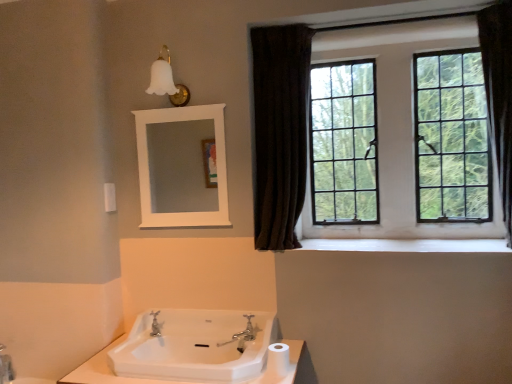
What do you see at coordinates (279, 131) in the screenshot? This screenshot has width=512, height=384. I see `dark brown velvet curtain at upper right` at bounding box center [279, 131].

The height and width of the screenshot is (384, 512). Describe the element at coordinates (167, 80) in the screenshot. I see `white glass sconce at upper left` at that location.

What do you see at coordinates (109, 197) in the screenshot? I see `white plastic towel bar at upper left` at bounding box center [109, 197].

You are a GUI agent. You are given a task and a screenshot of the screen. Output one action in this format:
    pyautogui.click(x=<x>, y=<y>)
    Task: Click on the silver metallic tap at lower center
    Image resolution: width=512 pixels, height=384 pixels.
    Given the screenshot: What is the action you would take?
    pyautogui.click(x=155, y=325)

What do you see at coordinates (155, 325) in the screenshot? The width and height of the screenshot is (512, 384). I see `silver metallic tap at lower center` at bounding box center [155, 325].

The width and height of the screenshot is (512, 384). In order to click on white smooth window sill at lower center in this screenshot , I will do `click(408, 245)`.

The height and width of the screenshot is (384, 512). Identify the location of dark brown velvet curtain at upper right. (279, 131).

Considering the relative sizes of white matte toilet paper at lower center and brown fabric curtain at right in the image provided, is white matte toilet paper at lower center shorter than brown fabric curtain at right?

Yes, white matte toilet paper at lower center is shorter than brown fabric curtain at right.

Visually, is white matte toilet paper at lower center positioned to the left or to the right of brown fabric curtain at right?

Based on their positions, white matte toilet paper at lower center is located to the left of brown fabric curtain at right.

Based on the photo, is white matte toilet paper at lower center inside the boundaries of brown fabric curtain at right, or outside?

white matte toilet paper at lower center is outside brown fabric curtain at right.

Is white glossy sink at lower center not within white plastic towel bar at upper left?

Absolutely, white glossy sink at lower center is external to white plastic towel bar at upper left.

Is white glossy sink at lower center further to the viewer compared to white plastic towel bar at upper left?

No.

Which of these two, white glossy sink at lower center or white plastic towel bar at upper left, is smaller?

Smaller between the two is white plastic towel bar at upper left.

Looking at this image, which object is further away from the camera, brown fabric curtain at right or silver metallic faucet at center?

silver metallic faucet at center is further away from the camera.

How far apart are brown fabric curtain at right and silver metallic faucet at center?

brown fabric curtain at right is 5.03 feet away from silver metallic faucet at center.

Does brown fabric curtain at right have a lesser width compared to silver metallic faucet at center?

In fact, brown fabric curtain at right might be wider than silver metallic faucet at center.

From the image's perspective, is brown fabric curtain at right below silver metallic faucet at center?

No.

Considering the positions of objects silver metallic tap at lower center and dark brown velvet curtain at upper right in the image provided, who is in front, silver metallic tap at lower center or dark brown velvet curtain at upper right?

dark brown velvet curtain at upper right is closer to the camera.

From the image's perspective, does silver metallic tap at lower center appear higher than dark brown velvet curtain at upper right?

Incorrect, from the image's perspective, silver metallic tap at lower center is lower than dark brown velvet curtain at upper right.

Is point (155, 332) closer or farther from the camera than point (253, 40)?

Point (155, 332).

Could you measure the distance between silver metallic tap at lower center and dark brown velvet curtain at upper right?

1.10 meters.

Which is more distant, [113,195] or [510,103]?

The point [113,195] is farther from the camera.

Can you confirm if white plastic towel bar at upper left is positioned to the right of brown fabric curtain at right?

In fact, white plastic towel bar at upper left is to the left of brown fabric curtain at right.

Looking at their sizes, would you say white plastic towel bar at upper left is wider or thinner than brown fabric curtain at right?

In the image, white plastic towel bar at upper left appears to be more narrow than brown fabric curtain at right.

From a real-world perspective, is white plastic towel bar at upper left over brown fabric curtain at right?

No, from a real-world perspective, white plastic towel bar at upper left is not on top of brown fabric curtain at right.

From a real-world perspective, is silver metallic faucet at center over brown fabric curtain at right?

Incorrect, from a real-world perspective, silver metallic faucet at center is lower than brown fabric curtain at right.

Would you say silver metallic faucet at center is a long distance from brown fabric curtain at right?

Yes, silver metallic faucet at center and brown fabric curtain at right are located far from each other.

In the image, there is a silver metallic faucet at center. Identify the location of shower curtain above it (from the image's perspective). The height and width of the screenshot is (384, 512). (499, 93).

Is silver metallic faucet at center oriented away from brown fabric curtain at right?

That's not correct — silver metallic faucet at center is not looking away from brown fabric curtain at right.

What's the angular difference between silver metallic faucet at center and white glossy sink at lower center's facing directions?

The facing directions of silver metallic faucet at center and white glossy sink at lower center are 89.7 degrees apart.

Is silver metallic faucet at center to the left or to the right of white glossy sink at lower center in the image?

silver metallic faucet at center is to the right of white glossy sink at lower center.

Is silver metallic faucet at center further to the viewer compared to white glossy sink at lower center?

That is True.

Is silver metallic faucet at center smaller than white glossy sink at lower center?

Yes, silver metallic faucet at center is smaller than white glossy sink at lower center.

The width and height of the screenshot is (512, 384). Identify the location of toilet paper below the brown fabric curtain at right (from the image's perspective). (278, 359).

The image size is (512, 384). In order to click on sink on the right side of white plastic towel bar at upper left in this screenshot , I will do `click(195, 346)`.

Which object lies nearer to the anchor point black glass window at upper right, white glass sconce at upper left or white smooth window sill at lower center?

white smooth window sill at lower center.

From the image, which object appears to be farther from white glass sconce at upper left, dark brown velvet curtain at upper right or brown fabric curtain at right?

The object further to white glass sconce at upper left is brown fabric curtain at right.

When comparing their distances from silver metallic tap at lower center, does white matte toilet paper at lower center or white glass sconce at upper left seem closer?

The object closer to silver metallic tap at lower center is white matte toilet paper at lower center.

Which object lies nearer to the anchor point black glass window at upper right, white matte toilet paper at lower center or white glossy sink at lower center?

white glossy sink at lower center.

Based on the photo, which object lies nearer to the anchor point white matte toilet paper at lower center, dark brown velvet curtain at upper right or white plastic towel bar at upper left?

Among the two, dark brown velvet curtain at upper right is located nearer to white matte toilet paper at lower center.

Looking at the image, which one is located closer to white glossy sink at lower center, white glass sconce at upper left or white matte toilet paper at lower center?

Among the two, white matte toilet paper at lower center is located nearer to white glossy sink at lower center.

Estimate the real-world distances between objects in this image. Which object is closer to silver metallic tap at lower center, silver metallic faucet at center or white wooden mirror at upper center?

silver metallic faucet at center.

From the image, which object appears to be nearer to white plastic towel bar at upper left, black glass window at upper right or white matte toilet paper at lower center?

white matte toilet paper at lower center is positioned closer to the anchor white plastic towel bar at upper left.

You are a GUI agent. You are given a task and a screenshot of the screen. Output one action in this format:
    pyautogui.click(x=<x>, y=<y>)
    Task: Click on the light fixture situated between silver metallic tap at lower center and white smooth window sill at lower center from left to right
    The image size is (512, 384).
    Given the screenshot: What is the action you would take?
    click(167, 80)

Locate an element on the screen. The image size is (512, 384). curtain between white plastic towel bar at upper left and white smooth window sill at lower center is located at coordinates (279, 131).

Where is `sink situated between silver metallic tap at lower center and brown fabric curtain at right from left to right`? Image resolution: width=512 pixels, height=384 pixels. sink situated between silver metallic tap at lower center and brown fabric curtain at right from left to right is located at coordinates (195, 346).

Where is `mirror located between white plastic towel bar at upper left and black glass window at upper right in the left-right direction`? The width and height of the screenshot is (512, 384). mirror located between white plastic towel bar at upper left and black glass window at upper right in the left-right direction is located at coordinates (181, 166).